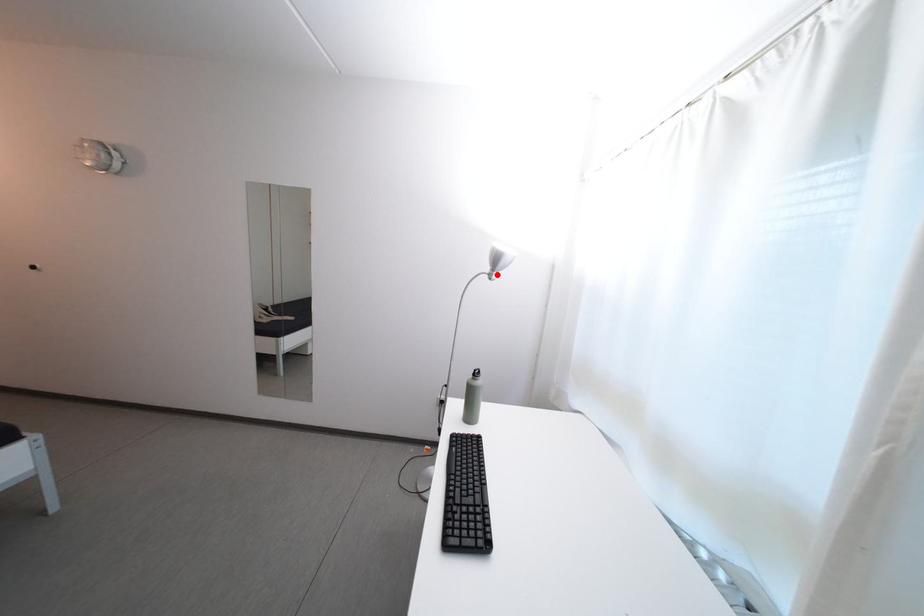
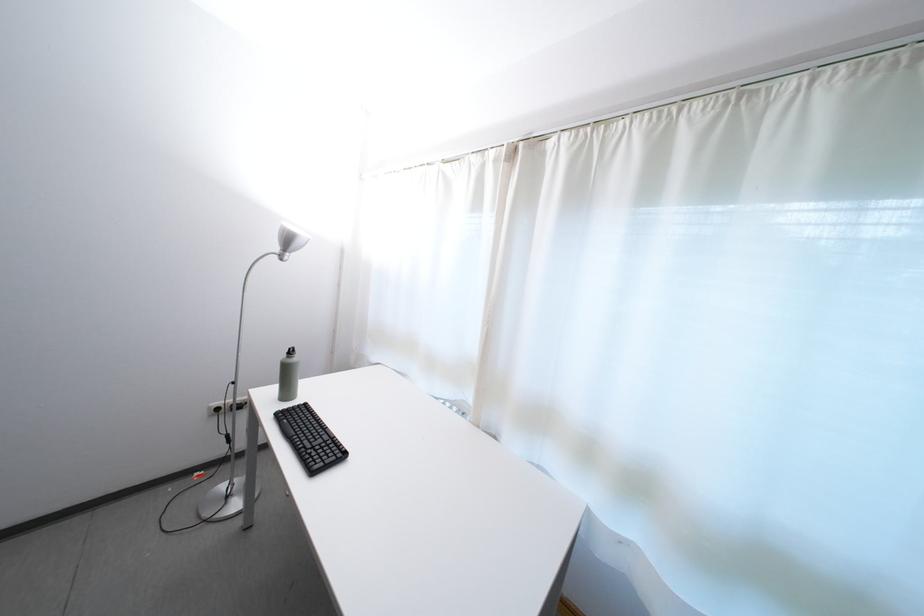
Question: I am providing you with two images of the same scene from different viewpoints. A red point is marked on the first image. Is the red point's position out of view in image 2?

Choices:
 (A) Yes
 (B) No

Answer: (B)